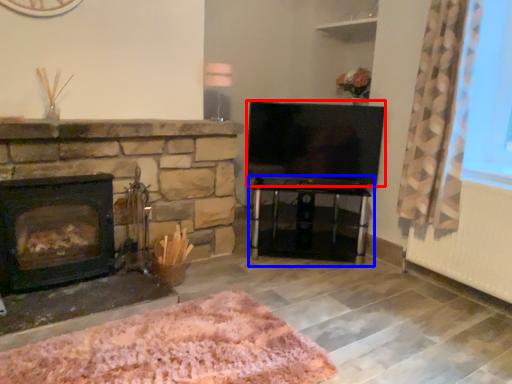
Question: Which object is closer to the camera taking this photo, television (highlighted by a red box) or table (highlighted by a blue box)?

Choices:
 (A) television
 (B) table

Answer: (B)